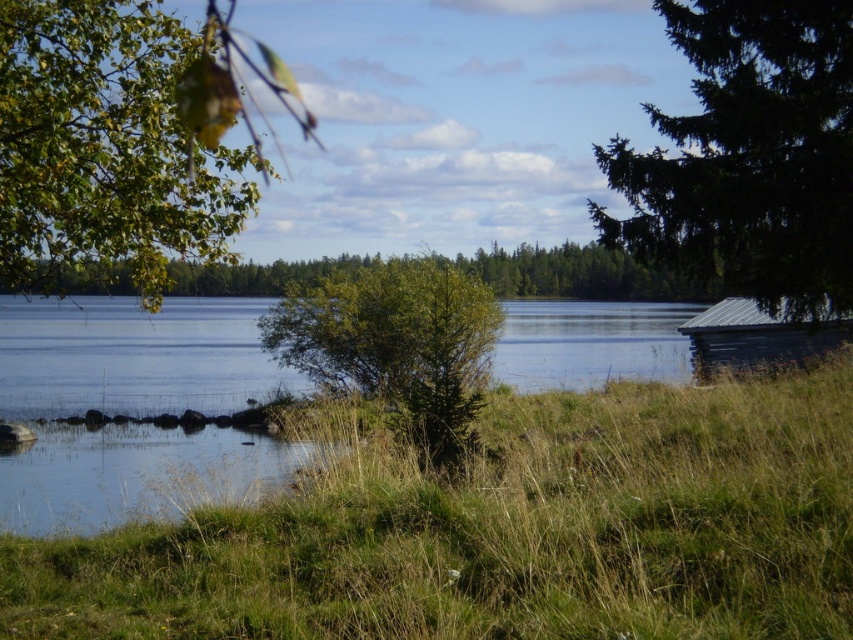
Is point (303, 353) closer to viewer compared to point (694, 337)?

No, (303, 353) is behind (694, 337).

In order to click on green leafy bush at center in this screenshot , I will do `click(396, 342)`.

Is green textured pine tree at right further to camera compared to green leafy tree at center?

Yes, green textured pine tree at right is further from the viewer.

Between point (651, 248) and point (271, 262), which one is positioned in front?

Point (651, 248)

Locate an element on the screen. green textured pine tree at right is located at coordinates (749, 156).

Does green textured pine tree at right have a lesser height compared to green leafy bush at center?

No, green textured pine tree at right is not shorter than green leafy bush at center.

The height and width of the screenshot is (640, 853). In order to click on green textured pine tree at right in this screenshot , I will do click(749, 156).